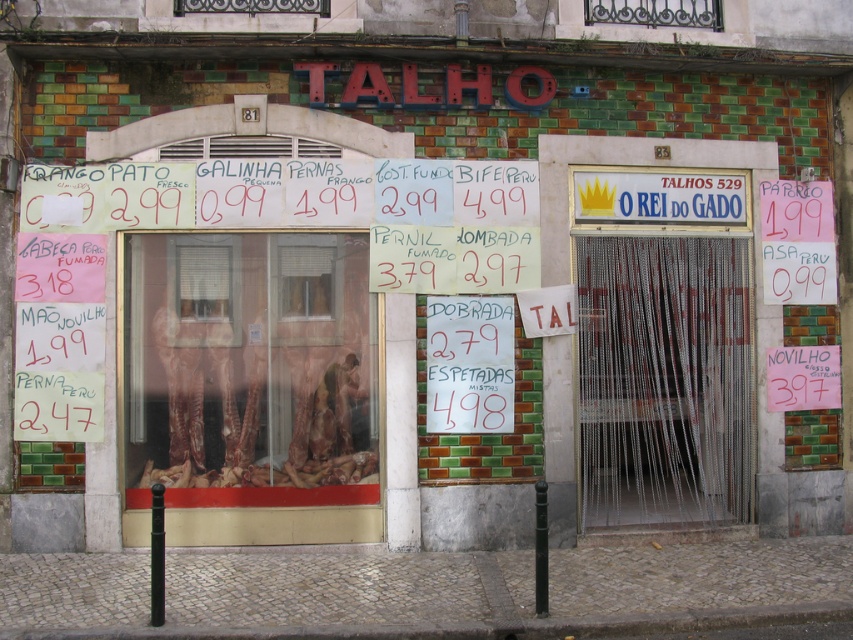
Is metal chain curtain at center taller than white paper sign at upper right?

Yes, metal chain curtain at center is taller than white paper sign at upper right.

From the picture: Is metal chain curtain at center bigger than white paper sign at upper right?

Correct, metal chain curtain at center is larger in size than white paper sign at upper right.

Who is more distant from viewer, (584, 236) or (786, 250)?

The point (786, 250) is more distant.

Locate an element on the screen. metal chain curtain at center is located at coordinates (664, 380).

Who is more distant from viewer, (154,356) or (270,8)?

Positioned behind is point (270,8).

Can you confirm if translucent glass at center is positioned above metallic glass window at upper center?

No.

Measure the distance between point (264, 381) and camera.

A distance of 8.69 meters exists between point (264, 381) and camera.

Locate an element on the screen. This screenshot has height=640, width=853. translucent glass at center is located at coordinates (250, 369).

Is the position of white paper sign at upper right less distant than that of metallic wrought iron at upper center?

No, white paper sign at upper right is further to the viewer.

Between point (817, 193) and point (712, 4), which one is positioned behind?

Point (817, 193)

You are a GUI agent. You are given a task and a screenshot of the screen. Output one action in this format:
    pyautogui.click(x=<x>, y=<y>)
    Task: Click on the white paper sign at upper right
    
    Given the screenshot: What is the action you would take?
    pyautogui.click(x=798, y=241)